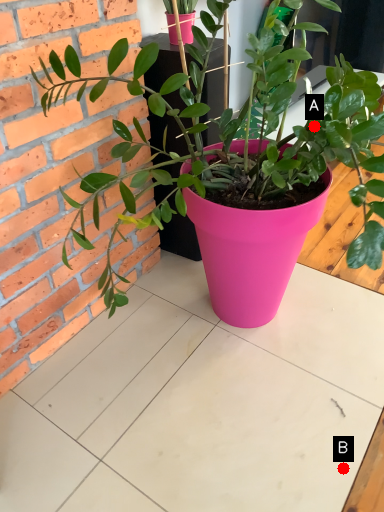
Question: Two points are circled on the image, labeled by A and B beside each circle. Which of the following is the farthest from the observer?

Choices:
 (A) A is further
 (B) B is further

Answer: (B)